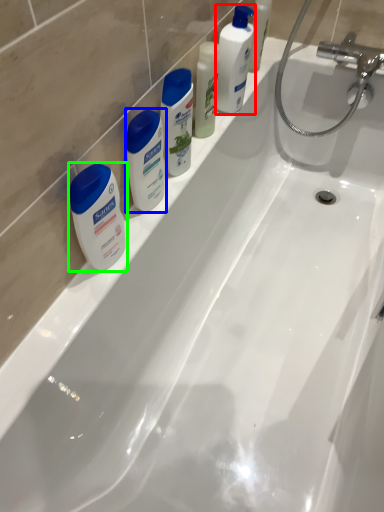
Question: Estimate the real-world distances between objects in this image. Which object is closer to cleaning product (highlighted by a red box), toiletry (highlighted by a blue box) or toiletry (highlighted by a green box)?

Choices:
 (A) toiletry
 (B) toiletry

Answer: (A)